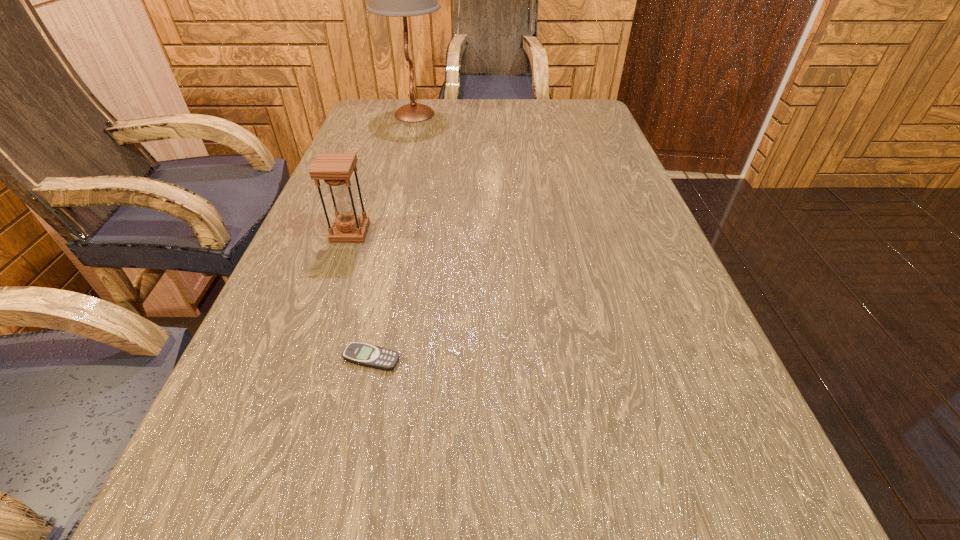
Image resolution: width=960 pixels, height=540 pixels. I want to click on table lamp, so click(403, 0).

The width and height of the screenshot is (960, 540). What are the coordinates of `the tallest object` in the screenshot? It's located at (403, 0).

Where is `the second farthest object`? the second farthest object is located at coordinates click(336, 169).

Identify the location of hourglass. (336, 169).

This screenshot has height=540, width=960. Find the location of `beeper`. beeper is located at coordinates (363, 354).

The image size is (960, 540). Find the location of `the shortest object`. the shortest object is located at coordinates (363, 354).

Locate an element on the screen. Image resolution: width=960 pixels, height=540 pixels. free spot located on the front-facing side of the table lamp is located at coordinates pyautogui.click(x=469, y=114).

This screenshot has height=540, width=960. Identify the location of free space located on the back of the hourglass. 380,149.

Find the location of a particular element. This screenshot has height=540, width=960. vacant position located 0.240m on the right of the beeper is located at coordinates (553, 359).

Image resolution: width=960 pixels, height=540 pixels. Identify the location of object located at the far edge. (403, 0).